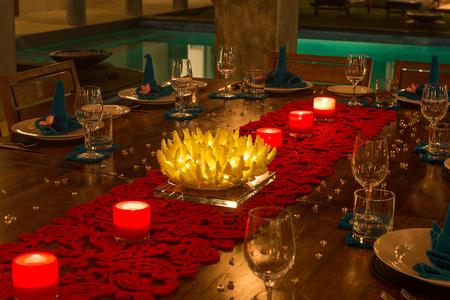
Image resolution: width=450 pixels, height=300 pixels. Find the location of `table mat`. table mat is located at coordinates (194, 238).